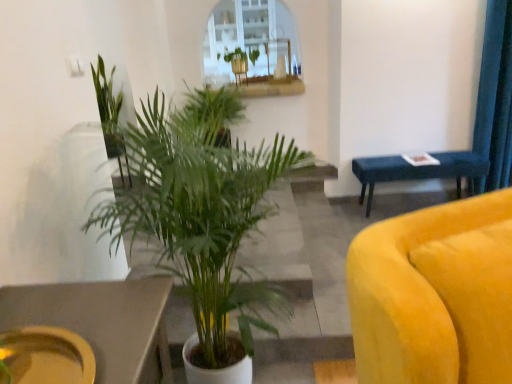
Question: Is green leafy plant at upper left, which ranks as the third houseplant in front-to-back order, taller than green leafy plant at center, which is the 3th houseplant from back to front?

Choices:
 (A) yes
 (B) no

Answer: (A)

Question: From a real-world perspective, is green leafy plant at upper left, the second houseplant from the back, located beneath green leafy plant at center, which is the 3th houseplant from back to front?

Choices:
 (A) no
 (B) yes

Answer: (A)

Question: Is green leafy plant at upper left, the second houseplant from the back, next to green leafy plant at center, which appears as the 2th houseplant when viewed from the front?

Choices:
 (A) no
 (B) yes

Answer: (A)

Question: Is the depth of green leafy plant at upper left, the second houseplant from the back, greater than that of green leafy plant at center, which is the 3th houseplant from back to front?

Choices:
 (A) no
 (B) yes

Answer: (B)

Question: Is green leafy plant at upper left, the second houseplant from the back, at the left side of green leafy plant at center, which is the 3th houseplant from back to front?

Choices:
 (A) yes
 (B) no

Answer: (A)

Question: From a real-world perspective, is green leafy plant at upper left, the second houseplant from the back, positioned over green leafy plant at center, which appears as the 2th houseplant when viewed from the front, based on gravity?

Choices:
 (A) yes
 (B) no

Answer: (A)

Question: Does green leafy plant at upper center, which appears as the fourth houseplant when viewed from the front, have a greater height compared to matte yellow platter at lower left?

Choices:
 (A) yes
 (B) no

Answer: (A)

Question: Would you say green leafy plant at upper center, which ranks as the 1th houseplant in back-to-front order, contains matte yellow platter at lower left?

Choices:
 (A) no
 (B) yes

Answer: (A)

Question: Considering the relative sizes of green leafy plant at upper center, which ranks as the 1th houseplant in back-to-front order, and matte yellow platter at lower left in the image provided, is green leafy plant at upper center, which ranks as the 1th houseplant in back-to-front order, thinner than matte yellow platter at lower left?

Choices:
 (A) no
 (B) yes

Answer: (B)

Question: Is green leafy plant at upper center, which ranks as the 1th houseplant in back-to-front order, with matte yellow platter at lower left?

Choices:
 (A) no
 (B) yes

Answer: (A)

Question: Could you tell me if green leafy plant at upper center, which ranks as the 1th houseplant in back-to-front order, is turned towards matte yellow platter at lower left?

Choices:
 (A) no
 (B) yes

Answer: (B)

Question: Is green leafy plant at upper center, which ranks as the 1th houseplant in back-to-front order, turned away from matte yellow platter at lower left?

Choices:
 (A) no
 (B) yes

Answer: (A)

Question: Would you say green leafy plant at center, which is the 3th houseplant from back to front, contains green leafy plant at center, which is the first houseplant in front-to-back order?

Choices:
 (A) yes
 (B) no

Answer: (B)